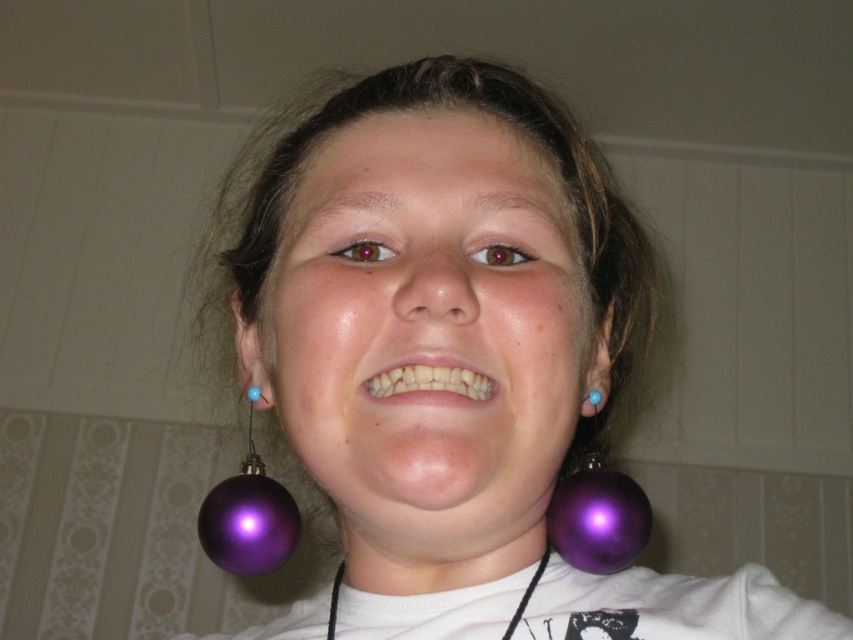
The image size is (853, 640). Describe the element at coordinates (457, 362) in the screenshot. I see `shiny purple earrings at center` at that location.

Who is more distant from viewer, (619,205) or (592,392)?

Positioned behind is point (619,205).

Between point (438, 563) and point (596, 392), which one is positioned behind?

Positioned behind is point (596, 392).

Where is `shiny purple earrings at center`? The height and width of the screenshot is (640, 853). shiny purple earrings at center is located at coordinates (457, 362).

Is shiny purple earrings at center bigger than black cord at center?

Yes, shiny purple earrings at center is bigger than black cord at center.

Is shiny purple earrings at center closer to the viewer compared to black cord at center?

Yes, shiny purple earrings at center is in front of black cord at center.

Locate an element on the screen. The image size is (853, 640). shiny purple earrings at center is located at coordinates (457, 362).

This screenshot has width=853, height=640. Find the location of `shiny purple earrings at center`. shiny purple earrings at center is located at coordinates (457, 362).

Which is behind, point (547, 541) or point (596, 397)?

Point (547, 541)

Find the location of a particular element. Image resolution: width=853 pixels, height=640 pixels. black cord at center is located at coordinates (527, 593).

What are the coordinates of `black cord at center` in the screenshot? It's located at (527, 593).